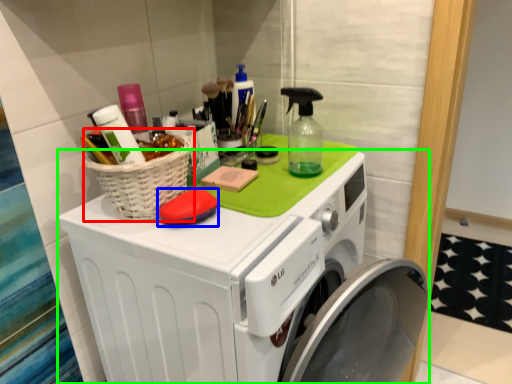
Question: Considering the real-world distances, which object is closest to basket (highlighted by a red box)? soap (highlighted by a blue box) or washing machine (highlighted by a green box).

Choices:
 (A) soap
 (B) washing machine

Answer: (A)